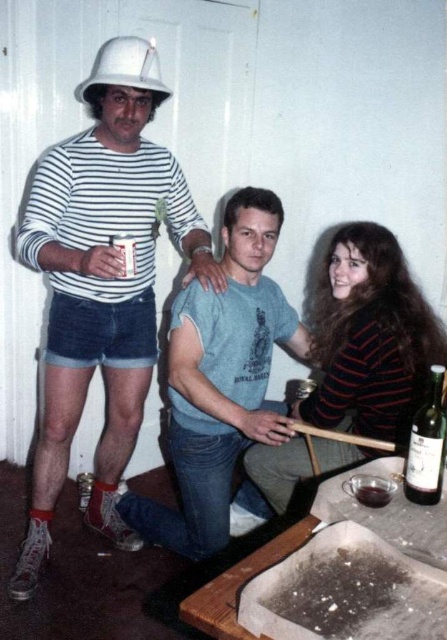
This screenshot has width=447, height=640. In order to click on white matte hard hat at left in this screenshot , I will do `click(102, 282)`.

Is white matte hard hat at left positioned before white matte hard hat at upper left?

Yes, it is in front of white matte hard hat at upper left.

Is point (97, 353) positioned after point (96, 81)?

Yes, point (97, 353) is farther from viewer.

You are a GUI agent. You are given a task and a screenshot of the screen. Output one action in this format:
    pyautogui.click(x=<x>, y=<y>)
    Task: Click on the white matte hard hat at left
    The height and width of the screenshot is (640, 447).
    Given the screenshot: What is the action you would take?
    pyautogui.click(x=102, y=282)

Is white matte hard hat at left wider than green glass bottle at lower right?

Indeed, white matte hard hat at left has a greater width compared to green glass bottle at lower right.

Measure the distance between white matte hard hat at left and camera.

white matte hard hat at left and camera are 1.67 meters apart.

The image size is (447, 640). I want to click on white matte hard hat at left, so click(x=102, y=282).

Based on the photo, can you confirm if white matte hard hat at left is smaller than dark glass wine at lower center?

No.

Can you confirm if white matte hard hat at left is thinner than dark glass wine at lower center?

No.

Is point (54, 337) positioned after point (362, 499)?

Yes, point (54, 337) is farther from viewer.

The height and width of the screenshot is (640, 447). Identify the location of white matte hard hat at left. (102, 282).